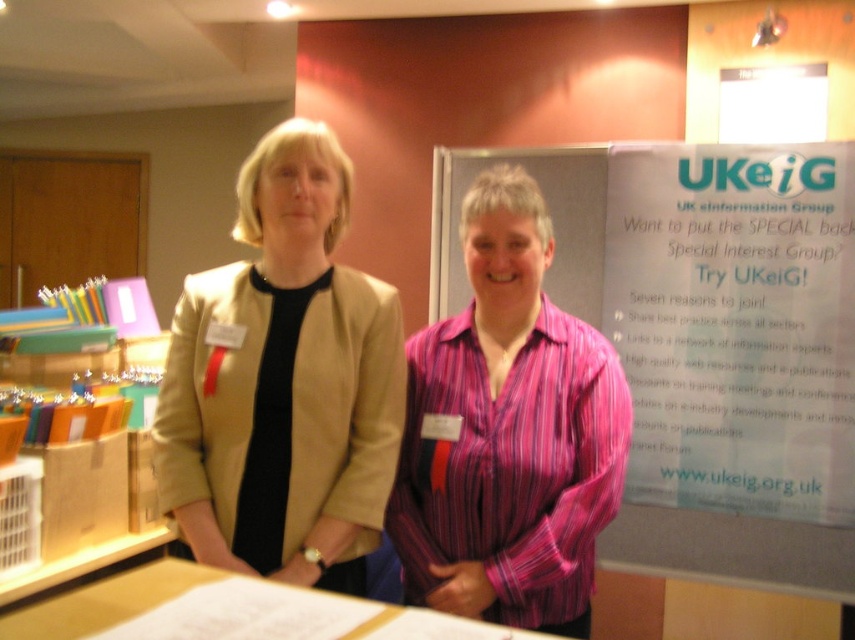
What object is located at the coordinates point (735, 324) in the image?

The point (735, 324) corresponds to the white paper at upper right.

You are a photographer at the event and want to ensure both the beige fabric jacket at center and the pink striped shirt at center are clearly visible in your photo. Which clothing item should you focus on first to account for their sizes?

The beige fabric jacket at center is shorter than the pink striped shirt at center, so focusing on the beige fabric jacket at center first would ensure it is captured properly before adjusting for the taller pink striped shirt at center.